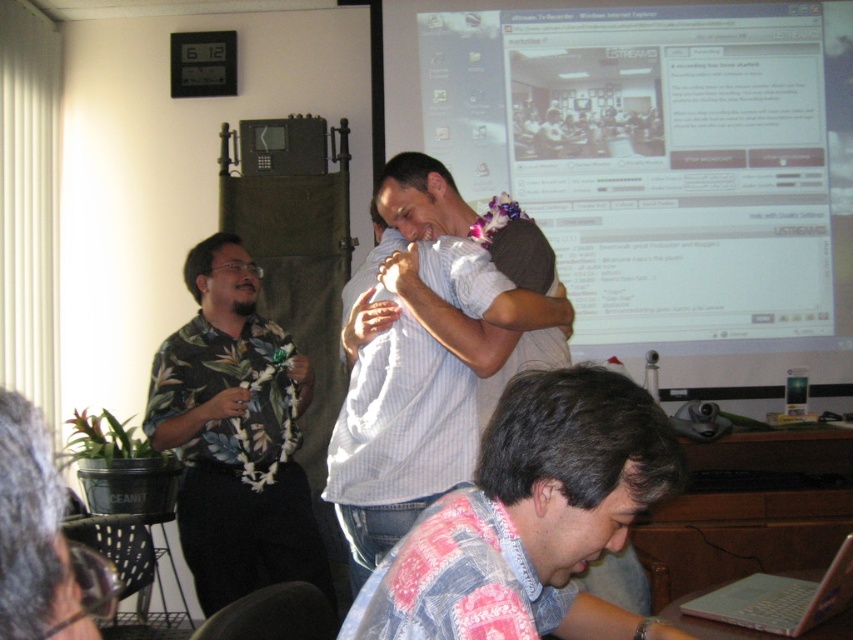
Question: Which point is farther to the camera?

Choices:
 (A) (814, 616)
 (B) (234, 580)

Answer: (B)

Question: Which point is closer to the camera?

Choices:
 (A) (610, 474)
 (B) (689, 108)

Answer: (A)

Question: Can you confirm if white glossy projection screen at upper center is smaller than white shirt at center?

Choices:
 (A) no
 (B) yes

Answer: (A)

Question: Which object appears closest to the camera in this image?

Choices:
 (A) white striped shirt at center
 (B) white shirt at center

Answer: (A)

Question: From the image, what is the correct spatial relationship of white glossy projection screen at upper center in relation to white striped shirt at center?

Choices:
 (A) right
 (B) left

Answer: (A)

Question: Does white glossy projection screen at upper center appear under silver metallic laptop at lower right?

Choices:
 (A) no
 (B) yes

Answer: (A)